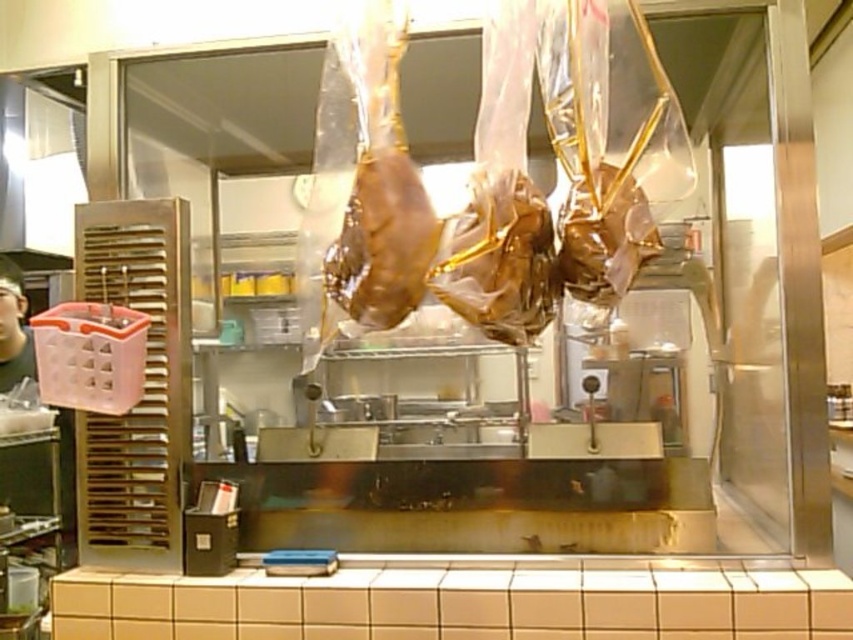
You are a chef in a commercial kitchen. You need to place a new roasted meat item on the countertop between the point at coordinate (467, 220) and another point. The new item is 12 inches long. Can it fit between them?

The two points are 36.88 inches apart, so the 12 inch long item can fit between them since it is shorter than the distance between the points.

You are a chef preparing to place a 10 cm tall container on the countertop. You see the shiny gold meat at center and the brown glossy meat at center. Which meat can you place the container next to without it being taller than the meat?

The shiny gold meat at center is shorter than the brown glossy meat at center, so the container should be placed next to the brown glossy meat at center to ensure it is not taller than the meat.